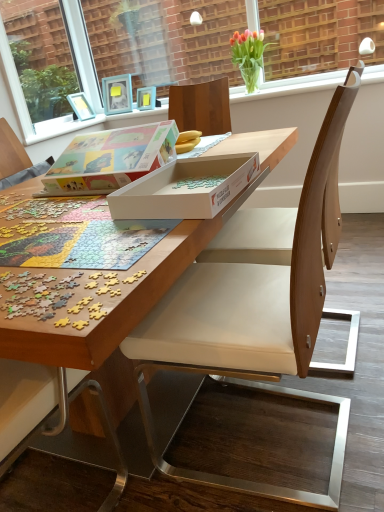
Where is `matte cardboard box at center, acting as the 2th box starting from the front`? matte cardboard box at center, acting as the 2th box starting from the front is located at coordinates (110, 159).

Image resolution: width=384 pixels, height=512 pixels. Find the location of `translucent glass vase at upper center`. translucent glass vase at upper center is located at coordinates (249, 55).

At what (x,y) coordinates should I click in order to perform the action: click on multicolored plastic jigsaw puzzle pieces at lower left. Please return your answer as a coordinate pair (x, y). Image resolution: width=384 pixels, height=512 pixels. Looking at the image, I should click on (37, 294).

Where is `wooden puzzle at center`? wooden puzzle at center is located at coordinates (138, 281).

What do you see at coordinates (138, 281) in the screenshot? The image size is (384, 512). I see `wooden puzzle at center` at bounding box center [138, 281].

Image resolution: width=384 pixels, height=512 pixels. What do you see at coordinates (117, 94) in the screenshot? I see `light blue wooden picture frame at upper center` at bounding box center [117, 94].

Where is `matte cardboard box at center, acting as the 2th box starting from the front`? Image resolution: width=384 pixels, height=512 pixels. matte cardboard box at center, acting as the 2th box starting from the front is located at coordinates (110, 159).

Is clear glass vase at upper center, the first window screen viewed from the right, smaller than wooden puzzle at center?

Yes, clear glass vase at upper center, the first window screen viewed from the right, is smaller than wooden puzzle at center.

From a real-world perspective, relative to wooden puzzle at center, is clear glass vase at upper center, which is the second window screen in left-to-right order, vertically above or below?

Clearly, from a real-world perspective, clear glass vase at upper center, which is the second window screen in left-to-right order, is above wooden puzzle at center.

Is clear glass vase at upper center, the first window screen viewed from the right, next to wooden puzzle at center and touching it?

No, clear glass vase at upper center, the first window screen viewed from the right, is not making contact with wooden puzzle at center.

Considering the positions of objects clear glass vase at upper center, which is the second window screen in left-to-right order, and wooden puzzle at center in the image provided, who is in front, clear glass vase at upper center, which is the second window screen in left-to-right order, or wooden puzzle at center?

Positioned in front is wooden puzzle at center.

Which is more to the left, clear glass window screen at upper left, marked as the 2th window screen in a right-to-left arrangement, or wooden puzzle at center?

clear glass window screen at upper left, marked as the 2th window screen in a right-to-left arrangement, is more to the left.

Measure the distance from clear glass window screen at upper left, positioned as the first window screen in left-to-right order, to wooden puzzle at center.

clear glass window screen at upper left, positioned as the first window screen in left-to-right order, and wooden puzzle at center are 8.20 feet apart from each other.

Considering the points (88, 63) and (30, 327), which point is in front, point (88, 63) or point (30, 327)?

The point (30, 327) is more forward.

Could you tell me if light blue wooden picture frame at upper center is turned towards translucent glass vase at upper center?

No, light blue wooden picture frame at upper center is not aimed at translucent glass vase at upper center.

Is light blue wooden picture frame at upper center positioned beyond the bounds of translucent glass vase at upper center?

Yes.

In the image, is light blue wooden picture frame at upper center positioned in front of or behind translucent glass vase at upper center?

In the image, light blue wooden picture frame at upper center appears behind translucent glass vase at upper center.

Is light brown wood chair at center closer to the viewer compared to translucent glass vase at upper center?

Yes, light brown wood chair at center is in front of translucent glass vase at upper center.

Which of these two, light brown wood chair at center or translucent glass vase at upper center, is bigger?

With larger size is light brown wood chair at center.

Is light brown wood chair at center shorter than translucent glass vase at upper center?

Incorrect, the height of light brown wood chair at center does not fall short of that of translucent glass vase at upper center.

Where is `window screen located on the right of multicolored plastic jigsaw puzzle pieces at lower left`? This screenshot has height=512, width=384. window screen located on the right of multicolored plastic jigsaw puzzle pieces at lower left is located at coordinates coord(172,48).

Who is shorter, multicolored plastic jigsaw puzzle pieces at lower left or clear glass vase at upper center, the first window screen viewed from the right?

With less height is multicolored plastic jigsaw puzzle pieces at lower left.

Is multicolored plastic jigsaw puzzle pieces at lower left wider or thinner than clear glass vase at upper center, the first window screen viewed from the right?

In the image, multicolored plastic jigsaw puzzle pieces at lower left appears to be wider than clear glass vase at upper center, the first window screen viewed from the right.

Is there a large distance between multicolored plastic jigsaw puzzle pieces at lower left and clear glass vase at upper center, which is the second window screen in left-to-right order?

Absolutely, multicolored plastic jigsaw puzzle pieces at lower left is distant from clear glass vase at upper center, which is the second window screen in left-to-right order.

Does point (86, 80) appear closer or farther from the camera than point (298, 313)?

Point (86, 80) is positioned farther from the camera compared to point (298, 313).

Is clear glass window screen at upper left, marked as the 2th window screen in a right-to-left arrangement, not near light brown wood chair at center?

clear glass window screen at upper left, marked as the 2th window screen in a right-to-left arrangement, is positioned a significant distance from light brown wood chair at center.

From the image's perspective, which one is positioned lower, clear glass window screen at upper left, positioned as the first window screen in left-to-right order, or light brown wood chair at center?

light brown wood chair at center.

Can you tell me how much clear glass window screen at upper left, marked as the 2th window screen in a right-to-left arrangement, and light brown wood chair at center differ in facing direction?

clear glass window screen at upper left, marked as the 2th window screen in a right-to-left arrangement, and light brown wood chair at center are facing 179 degrees away from each other.

The image size is (384, 512). Find the location of `the 1st window screen positioned above the multicolored plastic jigsaw puzzle pieces at lower left (from the image's perspective)`. the 1st window screen positioned above the multicolored plastic jigsaw puzzle pieces at lower left (from the image's perspective) is located at coordinates (81, 52).

From a real-world perspective, between multicolored plastic jigsaw puzzle pieces at lower left and clear glass window screen at upper left, marked as the 2th window screen in a right-to-left arrangement, who is vertically lower?

In real-world perspective, multicolored plastic jigsaw puzzle pieces at lower left is lower.

Can you confirm if multicolored plastic jigsaw puzzle pieces at lower left is thinner than clear glass window screen at upper left, marked as the 2th window screen in a right-to-left arrangement?

No.

In the image, is multicolored plastic jigsaw puzzle pieces at lower left positioned in front of or behind clear glass window screen at upper left, marked as the 2th window screen in a right-to-left arrangement?

multicolored plastic jigsaw puzzle pieces at lower left is positioned closer to the viewer than clear glass window screen at upper left, marked as the 2th window screen in a right-to-left arrangement.

You are a GUI agent. You are given a task and a screenshot of the screen. Output one action in this format:
    pyautogui.click(x=<x>, y=<y>)
    Task: Click on the window screen lying on the right of wooden puzzle at center
    The height and width of the screenshot is (512, 384).
    Given the screenshot: What is the action you would take?
    pyautogui.click(x=172, y=48)

Image resolution: width=384 pixels, height=512 pixels. What are the coordinates of `window screen on the left of wooden puzzle at center` in the screenshot? It's located at (81, 52).

Estimate the real-world distances between objects in this image. Which object is further from white cardboard box at center, marked as the second box in a back-to-front arrangement, matte cardboard box at center, acting as the 2th box starting from the front, or translucent glass vase at upper center?

translucent glass vase at upper center is positioned further to the anchor white cardboard box at center, marked as the second box in a back-to-front arrangement.

Based on their spatial positions, is clear glass window screen at upper left, positioned as the first window screen in left-to-right order, or multicolored plastic jigsaw puzzle pieces at lower left further from matte cardboard box at center, arranged as the first box when viewed from the back?

clear glass window screen at upper left, positioned as the first window screen in left-to-right order.

Consider the image. Based on their spatial positions, is white cardboard box at center, marked as the 1th box in a front-to-back arrangement, or clear glass vase at upper center, the first window screen viewed from the right, closer to clear glass window screen at upper left, marked as the 2th window screen in a right-to-left arrangement?

clear glass vase at upper center, the first window screen viewed from the right, lies closer to clear glass window screen at upper left, marked as the 2th window screen in a right-to-left arrangement, than the other object.

From the image, which object appears to be farther from clear glass window screen at upper left, marked as the 2th window screen in a right-to-left arrangement, light brown wood chair at center or multicolored plastic jigsaw puzzle pieces at lower left?

multicolored plastic jigsaw puzzle pieces at lower left is further to clear glass window screen at upper left, marked as the 2th window screen in a right-to-left arrangement.

Which object lies nearer to the anchor point light blue wooden picture frame at upper center, white cardboard box at center, marked as the second box in a back-to-front arrangement, or multicolored plastic jigsaw puzzle pieces at lower left?

white cardboard box at center, marked as the second box in a back-to-front arrangement, lies closer to light blue wooden picture frame at upper center than the other object.

From the image, which object appears to be farther from matte cardboard box at center, acting as the 2th box starting from the front, clear glass vase at upper center, the first window screen viewed from the right, or white cardboard box at center, marked as the 1th box in a front-to-back arrangement?

clear glass vase at upper center, the first window screen viewed from the right, is positioned further to the anchor matte cardboard box at center, acting as the 2th box starting from the front.

Which object lies further to the anchor point translucent glass vase at upper center, matte cardboard box at center, arranged as the first box when viewed from the back, or multicolored plastic jigsaw puzzle pieces at lower left?

Based on the image, multicolored plastic jigsaw puzzle pieces at lower left appears to be further to translucent glass vase at upper center.

Looking at the image, which one is located further to multicolored plastic jigsaw puzzle pieces at lower left, light brown wood chair at center or white cardboard box at center, marked as the 1th box in a front-to-back arrangement?

Among the two, light brown wood chair at center is located further to multicolored plastic jigsaw puzzle pieces at lower left.

At what (x,y) coordinates should I click in order to perform the action: click on houseplant between light brown wood chair at center and light blue wooden picture frame at upper center from front to back. Please return your answer as a coordinate pair (x, y). The height and width of the screenshot is (512, 384). Looking at the image, I should click on (249, 55).

Locate an element on the screen. This screenshot has height=512, width=384. chair between wooden puzzle at center and clear glass vase at upper center, which is the second window screen in left-to-right order, in the front-back direction is located at coordinates (323, 200).

The height and width of the screenshot is (512, 384). Find the location of `jigsaw puzzle between wooden puzzle at center and matte cardboard box at center, acting as the 2th box starting from the front, along the z-axis`. jigsaw puzzle between wooden puzzle at center and matte cardboard box at center, acting as the 2th box starting from the front, along the z-axis is located at coordinates (37, 294).

Find the location of a particular element. The image size is (384, 512). houseplant between wooden puzzle at center and light blue wooden picture frame at upper center in the front-back direction is located at coordinates (249, 55).